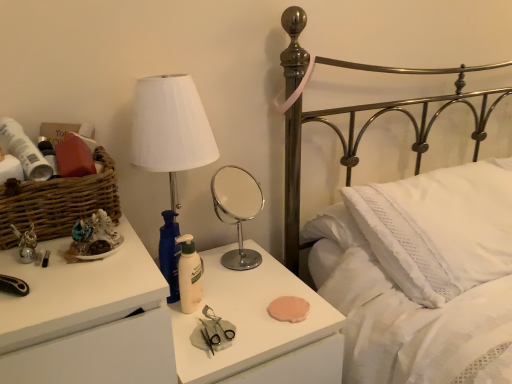
Question: Are white textured pillow at center and white fabric lampshade at upper left making contact?

Choices:
 (A) no
 (B) yes

Answer: (A)

Question: From the image's perspective, is white textured pillow at center on white fabric lampshade at upper left?

Choices:
 (A) no
 (B) yes

Answer: (A)

Question: Can you confirm if white textured pillow at center is shorter than white fabric lampshade at upper left?

Choices:
 (A) yes
 (B) no

Answer: (A)

Question: Does white textured pillow at center have a larger size compared to white fabric lampshade at upper left?

Choices:
 (A) no
 (B) yes

Answer: (B)

Question: Is white fabric lampshade at upper left at the back of white textured pillow at center?

Choices:
 (A) no
 (B) yes

Answer: (A)

Question: Is white textured pillow at center thinner than white fabric lampshade at upper left?

Choices:
 (A) no
 (B) yes

Answer: (A)

Question: Is metallic brass bed at upper right positioned behind white textured pillow at center?

Choices:
 (A) yes
 (B) no

Answer: (B)

Question: From a real-world perspective, is metallic brass bed at upper right on white textured pillow at center?

Choices:
 (A) yes
 (B) no

Answer: (B)

Question: From the image's perspective, is metallic brass bed at upper right below white textured pillow at center?

Choices:
 (A) no
 (B) yes

Answer: (A)

Question: Considering the relative sizes of metallic brass bed at upper right and white textured pillow at center in the image provided, is metallic brass bed at upper right thinner than white textured pillow at center?

Choices:
 (A) no
 (B) yes

Answer: (A)

Question: Considering the relative sizes of metallic brass bed at upper right and white textured pillow at center in the image provided, is metallic brass bed at upper right shorter than white textured pillow at center?

Choices:
 (A) yes
 (B) no

Answer: (B)

Question: Does metallic brass bed at upper right appear on the left side of white textured pillow at center?

Choices:
 (A) no
 (B) yes

Answer: (A)

Question: From the image's perspective, would you say matte plastic lotion at center, which is the second nightstand in left-to-right order, is shown under chrome/metallic round mirror at center?

Choices:
 (A) no
 (B) yes

Answer: (B)